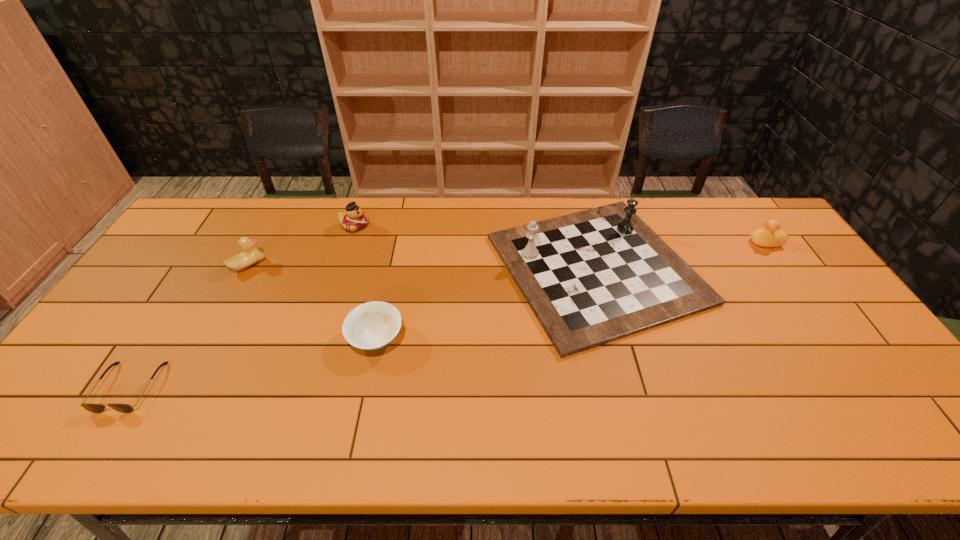
I want to click on sunglasses, so tap(92, 407).

Find the location of a particular element. the nearest object is located at coordinates (92, 407).

This screenshot has height=540, width=960. What are the coordinates of `free spot located 0.160m on the front of the second object from right to left` in the screenshot? It's located at (636, 417).

The width and height of the screenshot is (960, 540). I want to click on vacant space positioned 0.190m on the face of the fourth object from right to left, so click(x=425, y=226).

Locate an element on the screen. free region located at the beak of the leftmost duck is located at coordinates (354, 265).

Where is `free spot located 0.240m on the face of the rightmost object`? free spot located 0.240m on the face of the rightmost object is located at coordinates (676, 243).

Locate an element on the screen. The image size is (960, 540). free space located on the face of the rightmost object is located at coordinates (673, 243).

At what (x,y) coordinates should I click in order to perform the action: click on vacant point located 0.300m on the face of the rightmost object. Please return your answer as a coordinate pair (x, y). Looking at the image, I should click on (658, 243).

The width and height of the screenshot is (960, 540). I want to click on free point located on the right of the second shortest object, so click(488, 338).

Where is `vacant space located on the front-facing side of the nearest object`? The height and width of the screenshot is (540, 960). vacant space located on the front-facing side of the nearest object is located at coordinates (93, 443).